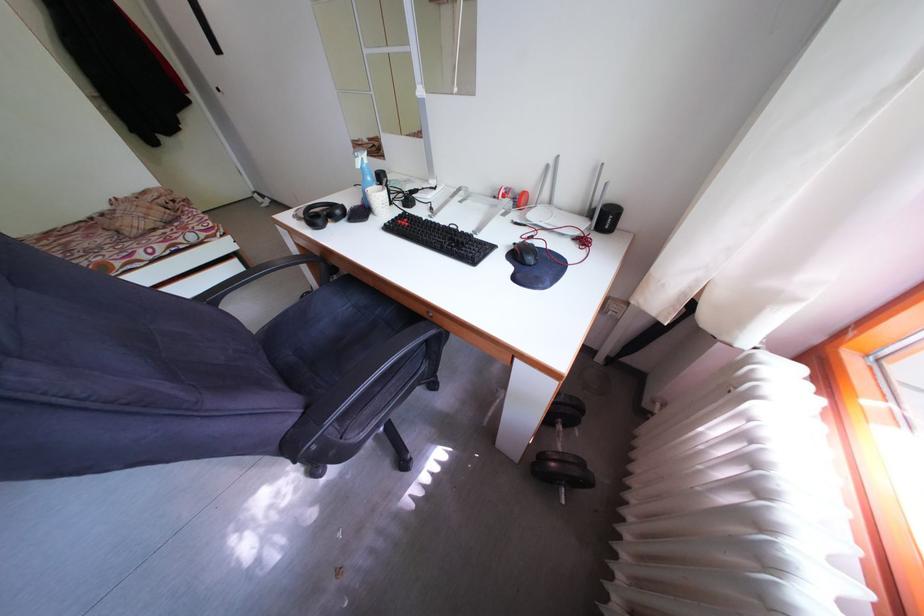
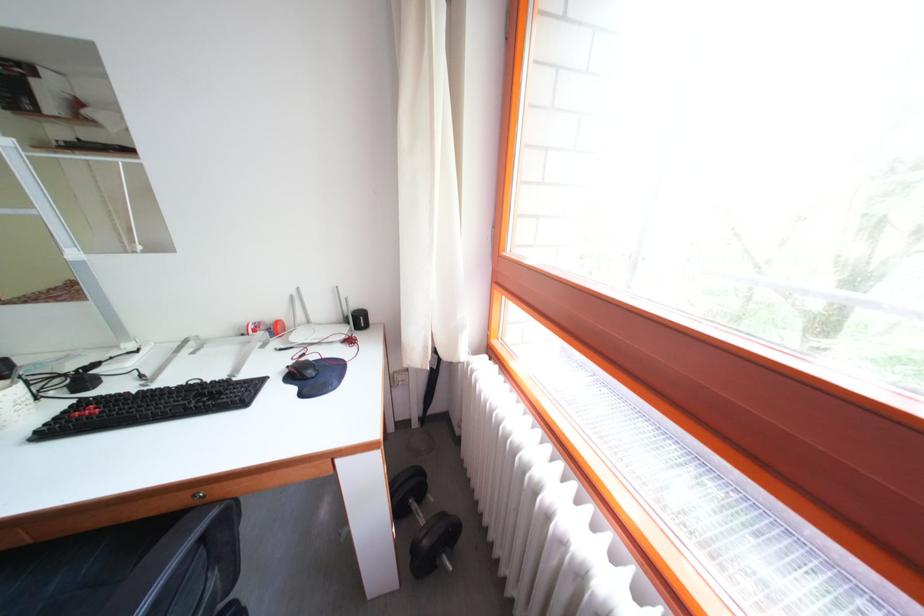
In the second image, find the point that corresponds to pixel 436 315 in the first image.

(203, 496)